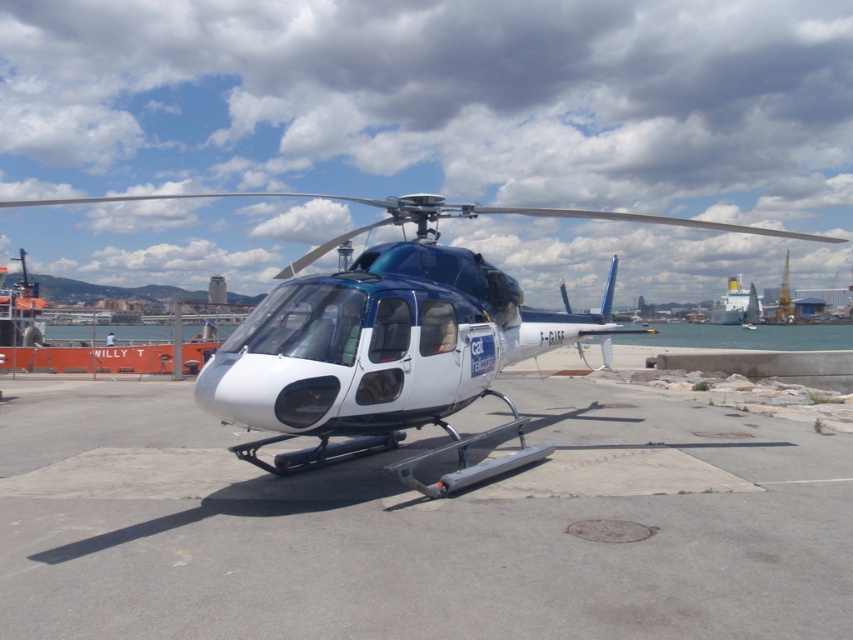
Between point (3, 630) and point (721, 317), which one is positioned behind?

Positioned behind is point (721, 317).

Which is more to the right, white concrete tarmac at center or white glossy ship at right?

From the viewer's perspective, white glossy ship at right appears more on the right side.

Between point (93, 432) and point (741, 307), which one is positioned in front?

Positioned in front is point (93, 432).

Identify the location of white concrete tarmac at center. (419, 525).

Does white concrete tarmac at center appear on the left side of white glossy helicopter at center?

No, white concrete tarmac at center is not to the left of white glossy helicopter at center.

The width and height of the screenshot is (853, 640). What do you see at coordinates (419, 525) in the screenshot?
I see `white concrete tarmac at center` at bounding box center [419, 525].

Which is behind, point (183, 424) or point (393, 196)?

The point (393, 196) is more distant.

This screenshot has width=853, height=640. I want to click on white concrete tarmac at center, so click(x=419, y=525).

Who is lower down, white glossy helicopter at center or white glossy ship at right?

white glossy ship at right is lower down.

Is white glossy helicopter at center bigger than white glossy ship at right?

Correct, white glossy helicopter at center is larger in size than white glossy ship at right.

Where is `white glossy helicopter at center`? The width and height of the screenshot is (853, 640). white glossy helicopter at center is located at coordinates (392, 340).

The width and height of the screenshot is (853, 640). In order to click on white glossy helicopter at center in this screenshot , I will do `click(392, 340)`.